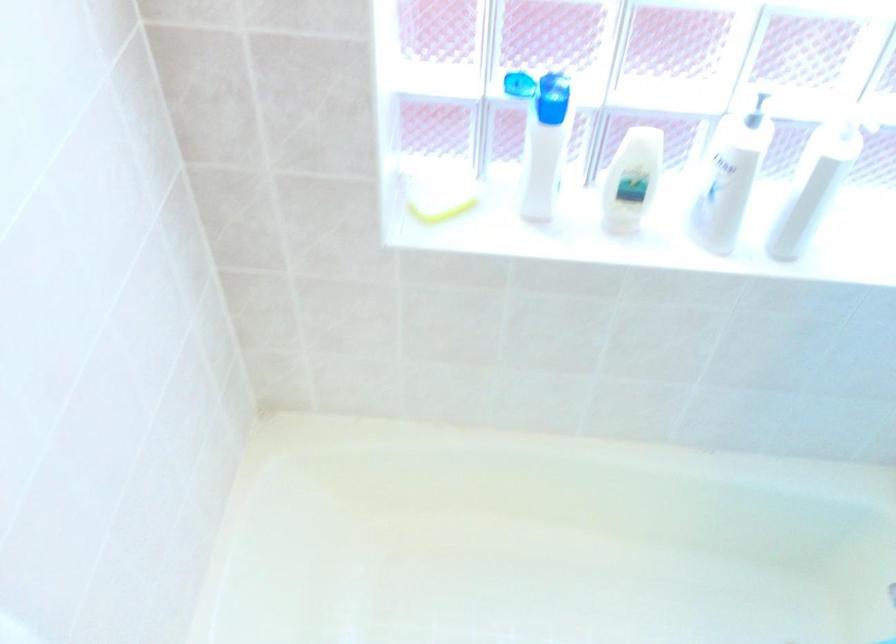
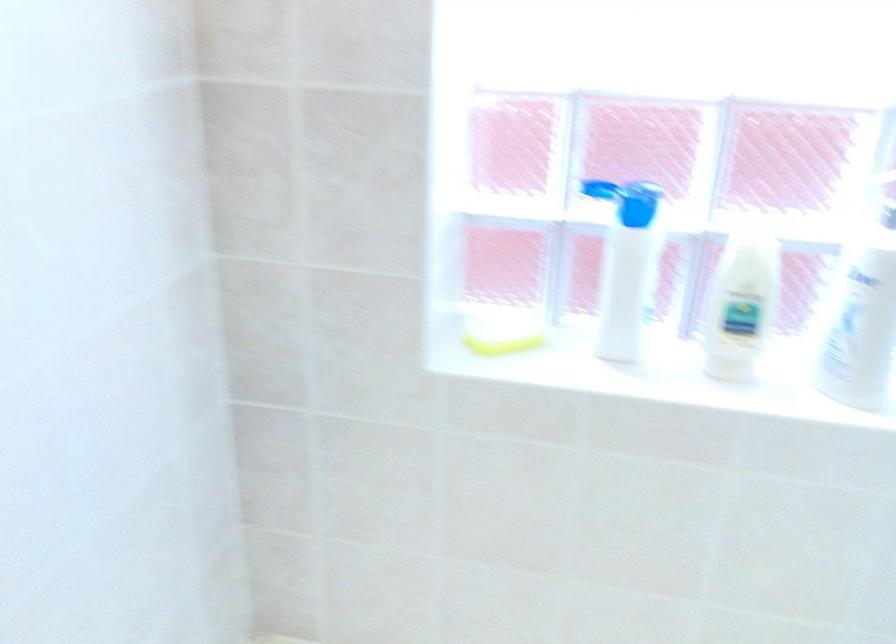
Where in the second image is the point corresponding to (x=444, y=213) from the first image?

(503, 344)